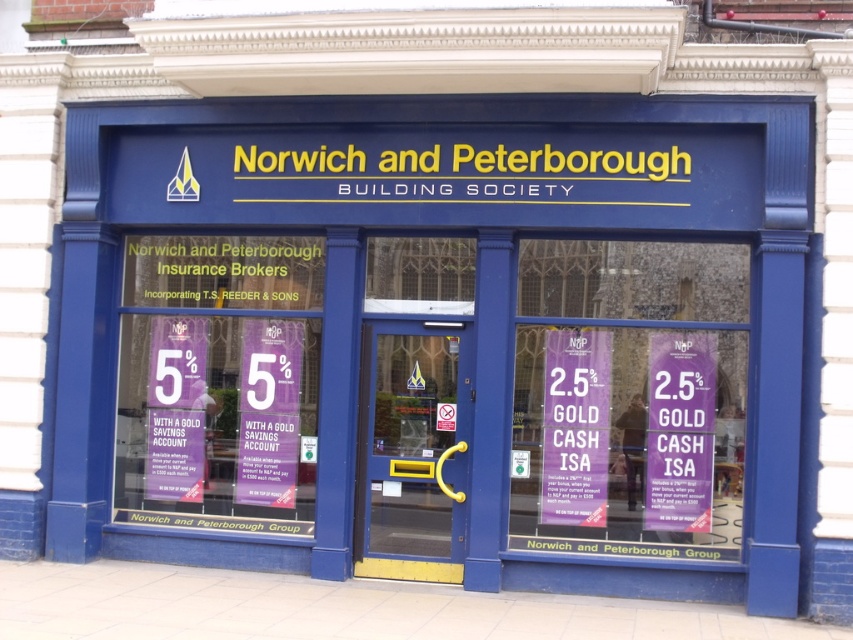
You are a customer at the Norwich and Peterborough Building Society. You notice two purple papers on the counter. One is the purple paper at center and the other is the purple paper at left. Which one is closer to you?

The purple paper at center is closer to you because it is in front of the purple paper at left.